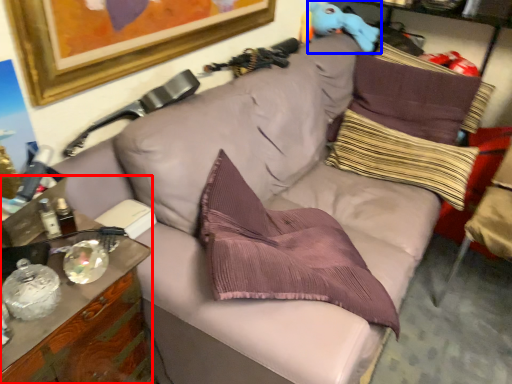
Question: Which object appears closest to the camera in this image, cabinetry (highlighted by a red box) or toy (highlighted by a blue box)?

Choices:
 (A) cabinetry
 (B) toy

Answer: (A)